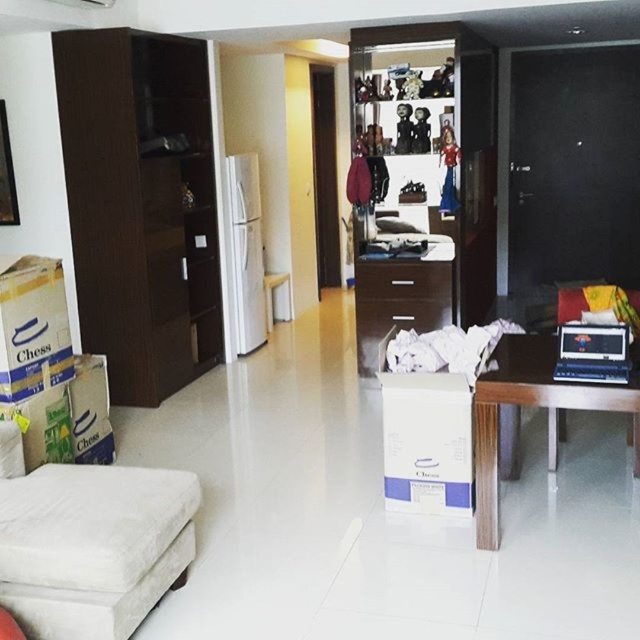
You are arranging a small potted plant in the living space. You want to place it between the wooden table at right and the dark wood drawer at center. Is there enough space between them to fit the plant?

The wooden table at right is to the right of the dark wood drawer at center, so there is space between them to place the potted plant.

You are a guest entering the living room and want to sit down. You see the white fabric ottoman at lower left and the wooden drawer at center. Which one is closer to you as you enter?

The white fabric ottoman at lower left is closer to you since it is in front of the wooden drawer at center.

You are standing in the living space and want to move from the dark brown wooden cabinet to the white refrigerator. Which point, point (556, 396) or point (28, 372), is closer to you as you start moving towards the refrigerator?

Point (556, 396) is closer to the viewer than point (28, 372), so you would be closer to point (556, 396) when starting your movement towards the refrigerator.